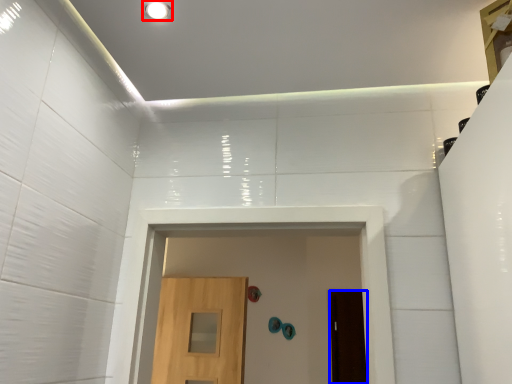
Question: Which point is closer to the camera, lighting (highlighted by a red box) or door (highlighted by a blue box)?

Choices:
 (A) lighting
 (B) door

Answer: (A)